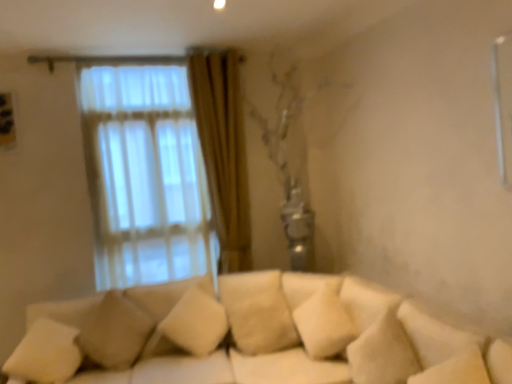
Question: Does beige fabric pillow at center, the first pillow from the right, have a smaller size compared to beige fabric pillow at lower left, which is the 2th pillow from left to right?

Choices:
 (A) no
 (B) yes

Answer: (A)

Question: Are beige fabric pillow at center, the third pillow when ordered from left to right, and beige fabric pillow at lower left, which is the 2th pillow from left to right, making contact?

Choices:
 (A) no
 (B) yes

Answer: (A)

Question: Is beige fabric pillow at center, the first pillow from the right, aimed at beige fabric pillow at lower left, which is the 2th pillow from left to right?

Choices:
 (A) no
 (B) yes

Answer: (A)

Question: Are beige fabric pillow at center, the first pillow from the right, and beige fabric pillow at lower left, which is the 2th pillow from left to right, far apart?

Choices:
 (A) no
 (B) yes

Answer: (A)

Question: From a real-world perspective, is beige fabric pillow at center, the first pillow from the right, under beige fabric pillow at lower left, the second pillow viewed from the right?

Choices:
 (A) yes
 (B) no

Answer: (A)

Question: Is beige fabric pillow at center, the third pillow when ordered from left to right, surrounding beige fabric pillow at lower left, which is the 2th pillow from left to right?

Choices:
 (A) no
 (B) yes

Answer: (A)

Question: Is beige fabric pillow at lower left, which is the 2th pillow from left to right, completely or partially outside of white soft pillow at lower left, which appears as the 3th pillow when viewed from the right?

Choices:
 (A) no
 (B) yes

Answer: (B)

Question: Would you say beige fabric pillow at lower left, the second pillow viewed from the right, contains white soft pillow at lower left, which appears as the 3th pillow when viewed from the right?

Choices:
 (A) no
 (B) yes

Answer: (A)

Question: Is beige fabric pillow at lower left, which is the 2th pillow from left to right, at the right side of white soft pillow at lower left, which is the 1th pillow in left-to-right order?

Choices:
 (A) yes
 (B) no

Answer: (A)

Question: Is beige fabric pillow at lower left, the second pillow viewed from the right, next to white soft pillow at lower left, which is the 1th pillow in left-to-right order?

Choices:
 (A) no
 (B) yes

Answer: (A)

Question: Could you tell me if beige fabric pillow at lower left, the second pillow viewed from the right, is facing white soft pillow at lower left, which is the 1th pillow in left-to-right order?

Choices:
 (A) yes
 (B) no

Answer: (B)

Question: From a real-world perspective, is beige fabric pillow at lower left, which is the 2th pillow from left to right, positioned under white soft pillow at lower left, which appears as the 3th pillow when viewed from the right, based on gravity?

Choices:
 (A) no
 (B) yes

Answer: (A)

Question: Are beige fabric pillow at center, the first pillow from the right, and white soft pillow at lower left, which appears as the 3th pillow when viewed from the right, making contact?

Choices:
 (A) no
 (B) yes

Answer: (A)